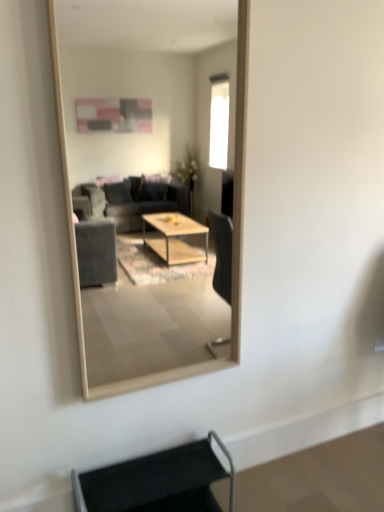
Question: Considering the relative sizes of wooden frame mirror at center and black fabric armchair at lower center in the image provided, is wooden frame mirror at center bigger than black fabric armchair at lower center?

Choices:
 (A) no
 (B) yes

Answer: (B)

Question: From a real-world perspective, is wooden frame mirror at center located higher than black fabric armchair at lower center?

Choices:
 (A) no
 (B) yes

Answer: (B)

Question: Is wooden frame mirror at center thinner than black fabric armchair at lower center?

Choices:
 (A) yes
 (B) no

Answer: (A)

Question: Are wooden frame mirror at center and black fabric armchair at lower center far apart?

Choices:
 (A) yes
 (B) no

Answer: (A)

Question: Is wooden frame mirror at center oriented away from black fabric armchair at lower center?

Choices:
 (A) no
 (B) yes

Answer: (A)

Question: Can you confirm if wooden frame mirror at center is positioned to the left of black fabric armchair at lower center?

Choices:
 (A) yes
 (B) no

Answer: (B)

Question: Does black fabric armchair at lower center have a smaller size compared to wooden frame mirror at center?

Choices:
 (A) no
 (B) yes

Answer: (B)

Question: Does black fabric armchair at lower center turn towards wooden frame mirror at center?

Choices:
 (A) no
 (B) yes

Answer: (A)

Question: From the image's perspective, is black fabric armchair at lower center below wooden frame mirror at center?

Choices:
 (A) yes
 (B) no

Answer: (A)

Question: Is black fabric armchair at lower center positioned far away from wooden frame mirror at center?

Choices:
 (A) no
 (B) yes

Answer: (B)

Question: Is black fabric armchair at lower center at the right side of wooden frame mirror at center?

Choices:
 (A) yes
 (B) no

Answer: (B)

Question: Is black fabric armchair at lower center shorter than wooden frame mirror at center?

Choices:
 (A) no
 (B) yes

Answer: (B)

Question: Looking at their shapes, would you say black fabric armchair at lower center is wider or thinner than wooden frame mirror at center?

Choices:
 (A) thin
 (B) wide

Answer: (B)